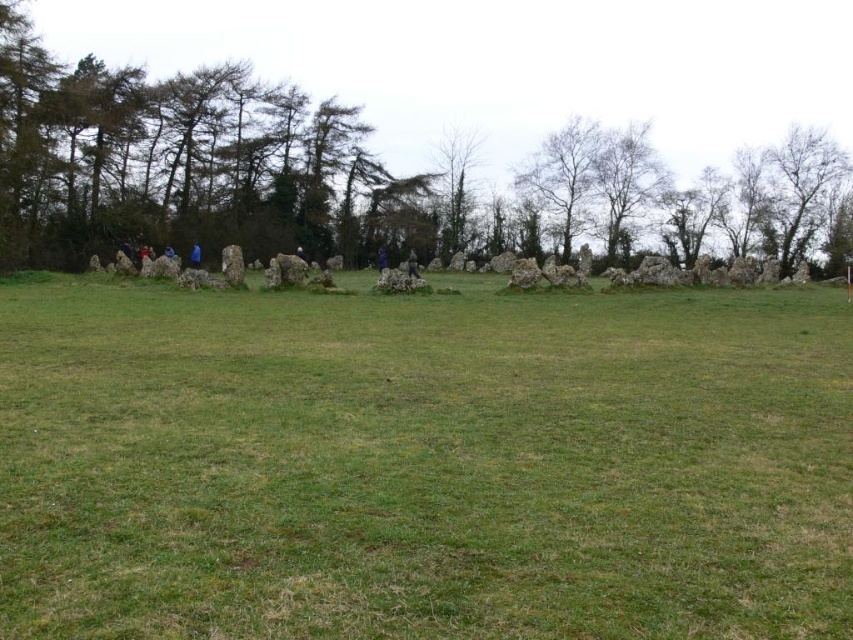
You are standing in the open grassy field and want to walk towards the bare wood tree at upper right. Which direction should you move relative to the green grassy field at center?

You should move to the right side of the green grassy field at center since the bare wood tree at upper right is positioned on the right side of it.

You are a landscape architect planning to install a new walking path between the green grassy field at center and the green leafy tree at upper center. The path must be exactly 60 meters long. Can the path be placed as planned?

The distance between the green grassy field at center and the green leafy tree at upper center is 63.70 meters. Since the path needs to be exactly 60 meters long, it cannot be placed as planned because the required length is shorter than the actual distance between them.

You are standing in the open grassy field looking at the ancient stone circle in the background. There are two points marked on the ground in front of you. One is at coordinate point (212, 301) and the other is at point (798, 141). Which point is closer to you?

Point (212, 301) is closer to the viewer than point (798, 141).